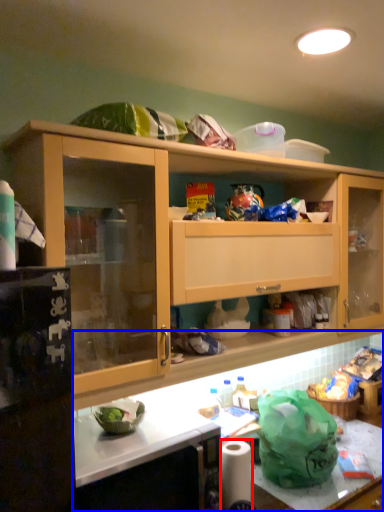
Question: Which object appears farthest to the camera in this image, toilet paper (highlighted by a red box) or countertop (highlighted by a blue box)?

Choices:
 (A) toilet paper
 (B) countertop

Answer: (A)